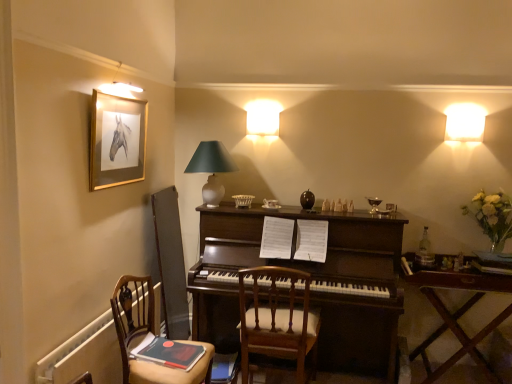
What do you see at coordinates (465, 122) in the screenshot?
I see `white frosted glass lampshade at upper right` at bounding box center [465, 122].

Identify the location of gold-framed picture at upper left. 117,140.

Locate an element on the screen. This screenshot has width=512, height=384. wooden chair at center, arranged as the second chair when viewed from the left is located at coordinates (277, 318).

Locate an element on the screen. This screenshot has width=512, height=384. matte white lampshade at center is located at coordinates (211, 169).

At what (x,y) coordinates should I click in order to perform the action: click on white frosted glass lampshade at upper right. Please return your answer as a coordinate pair (x, y). Looking at the image, I should click on (465, 122).

Considering the sizes of gold-framed picture at upper left and wooden table at right in the image, is gold-framed picture at upper left taller or shorter than wooden table at right?

gold-framed picture at upper left is shorter than wooden table at right.

Considering the relative positions of gold-framed picture at upper left and wooden table at right in the image provided, is gold-framed picture at upper left behind wooden table at right?

No, gold-framed picture at upper left is closer to the viewer.

From the image's perspective, between gold-framed picture at upper left and wooden table at right, who is located below?

wooden table at right is shown below in the image.

From a real-world perspective, is wooden chair at lower left, acting as the 2th chair starting from the right, below matte white lampshade at center?

Correct, in the physical world, wooden chair at lower left, acting as the 2th chair starting from the right, is lower than matte white lampshade at center.

From the picture: Is wooden chair at lower left, the first chair viewed from the left, not within matte white lampshade at center?

That's correct, wooden chair at lower left, the first chair viewed from the left, is outside of matte white lampshade at center.

Is point (151, 296) farther from camera compared to point (213, 163)?

That is False.

What's the angular difference between wooden chair at lower left, the first chair viewed from the left, and matte white lampshade at center's facing directions?

86.9 degrees separate the facing orientations of wooden chair at lower left, the first chair viewed from the left, and matte white lampshade at center.

Is gold-framed picture at upper left looking in the opposite direction of dark wood piano at center?

No.

Is gold-framed picture at upper left positioned beyond the bounds of dark wood piano at center?

Absolutely, gold-framed picture at upper left is external to dark wood piano at center.

From a real-world perspective, which is physically below, gold-framed picture at upper left or dark wood piano at center?

dark wood piano at center, from a real-world perspective.

Is point (181, 374) closer or farther from the camera than point (131, 147)?

Clearly, point (181, 374) is closer to the camera than point (131, 147).

How far apart are wooden chair at lower left, acting as the 2th chair starting from the right, and gold-framed picture at upper left?

wooden chair at lower left, acting as the 2th chair starting from the right, and gold-framed picture at upper left are 33.67 inches apart from each other.

Between wooden chair at lower left, the first chair viewed from the left, and gold-framed picture at upper left, which one is positioned in front?

wooden chair at lower left, the first chair viewed from the left, is closer to the camera.

Considering the relative positions of dark wood piano at center and gold-framed picture at upper left in the image provided, is dark wood piano at center to the right of gold-framed picture at upper left from the viewer's perspective?

Indeed, dark wood piano at center is positioned on the right side of gold-framed picture at upper left.

How different are the orientations of dark wood piano at center and gold-framed picture at upper left in degrees?

89.9 degrees separate the facing orientations of dark wood piano at center and gold-framed picture at upper left.

From the image's perspective, is dark wood piano at center on gold-framed picture at upper left?

No, from the image's perspective, dark wood piano at center is not on top of gold-framed picture at upper left.

Can you confirm if matte white lampshade at center is bigger than gold-framed picture at upper left?

Correct, matte white lampshade at center is larger in size than gold-framed picture at upper left.

Is matte white lampshade at center completely or partially outside of gold-framed picture at upper left?

Indeed, matte white lampshade at center is completely outside gold-framed picture at upper left.

Does matte white lampshade at center lie in front of gold-framed picture at upper left?

No, matte white lampshade at center is further to the viewer.

How many degrees apart are the facing directions of matte white lampshade at center and gold-framed picture at upper left?

They differ by 88.4 degrees in their facing directions.

Considering the positions of objects dark wood piano at center and wooden chair at center, arranged as the second chair when viewed from the left, in the image provided, who is more to the left, dark wood piano at center or wooden chair at center, arranged as the second chair when viewed from the left,?

From the viewer's perspective, wooden chair at center, arranged as the second chair when viewed from the left, appears more on the left side.

Locate an element on the screen. Image resolution: width=512 pixels, height=384 pixels. piano behind the wooden chair at center, arranged as the second chair when viewed from the left is located at coordinates (312, 284).

Is dark wood piano at center facing towards wooden chair at center, arranged as the second chair when viewed from the left?

Yes.

Identify the location of table on the right side of gold-framed picture at upper left. This screenshot has width=512, height=384. pos(456,312).

The image size is (512, 384). I want to click on table lamp above the wooden chair at lower left, acting as the 2th chair starting from the right (from a real-world perspective), so click(211, 169).

From the image, which object appears to be nearer to matte white lampshade at center, wooden table at right or gold-framed picture at upper left?

gold-framed picture at upper left.

Based on their spatial positions, is white frosted glass lampshade at upper right or matte white lampshade at center further from wooden table at right?

Based on the image, matte white lampshade at center appears to be further to wooden table at right.

Considering their positions, is wooden table at right positioned further to dark wood piano at center than matte white lampshade at center?

The object further to dark wood piano at center is wooden table at right.

From the image, which object appears to be nearer to wooden table at right, white frosted glass lampshade at upper right or wooden chair at center, arranged as the second chair when viewed from the left?

Among the two, wooden chair at center, arranged as the second chair when viewed from the left, is located nearer to wooden table at right.

When comparing their distances from wooden table at right, does matte white lampshade at center or wooden chair at lower left, the first chair viewed from the left, seem further?

Among the two, wooden chair at lower left, the first chair viewed from the left, is located further to wooden table at right.

Which object lies further to the anchor point gold-framed picture at upper left, wooden chair at lower left, the first chair viewed from the left, or wooden table at right?

wooden table at right is further to gold-framed picture at upper left.

Looking at the image, which one is located closer to wooden chair at lower left, acting as the 2th chair starting from the right, white frosted glass lampshade at upper right or wooden table at right?

wooden table at right lies closer to wooden chair at lower left, acting as the 2th chair starting from the right, than the other object.

Looking at this image, which object lies further to the anchor point dark wood piano at center, gold-framed picture at upper left or wooden table at right?

The object further to dark wood piano at center is gold-framed picture at upper left.

This screenshot has width=512, height=384. I want to click on piano between matte white lampshade at center and wooden chair at center, acting as the 1th chair starting from the right, from top to bottom, so click(312, 284).

Find the location of a particular element. chair between matte white lampshade at center and wooden chair at center, acting as the 1th chair starting from the right, vertically is located at coordinates (146, 333).

Where is `piano situated between matte white lampshade at center and wooden table at right from left to right`? This screenshot has width=512, height=384. piano situated between matte white lampshade at center and wooden table at right from left to right is located at coordinates (312, 284).

Identify the location of chair located between wooden chair at lower left, the first chair viewed from the left, and wooden table at right in the left-right direction. (277, 318).